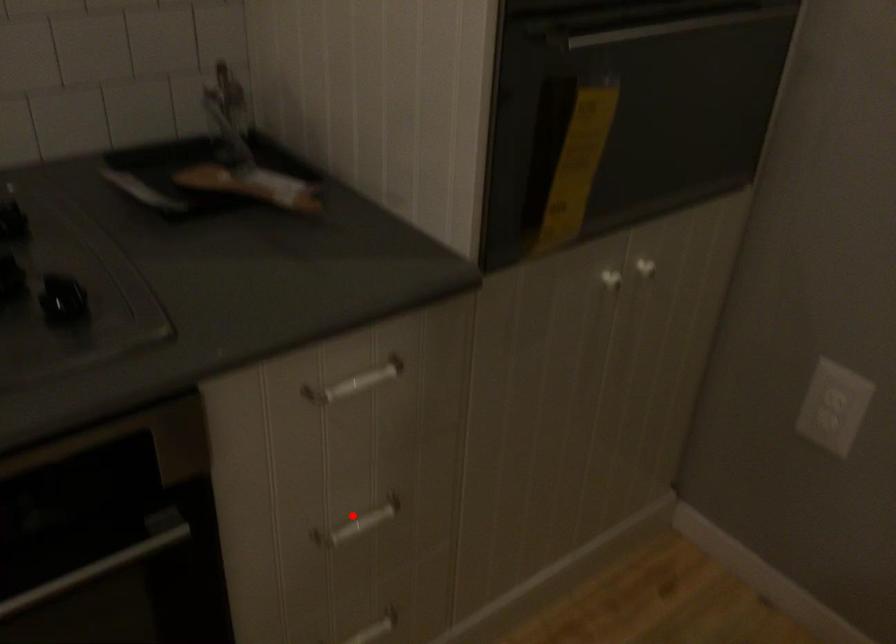
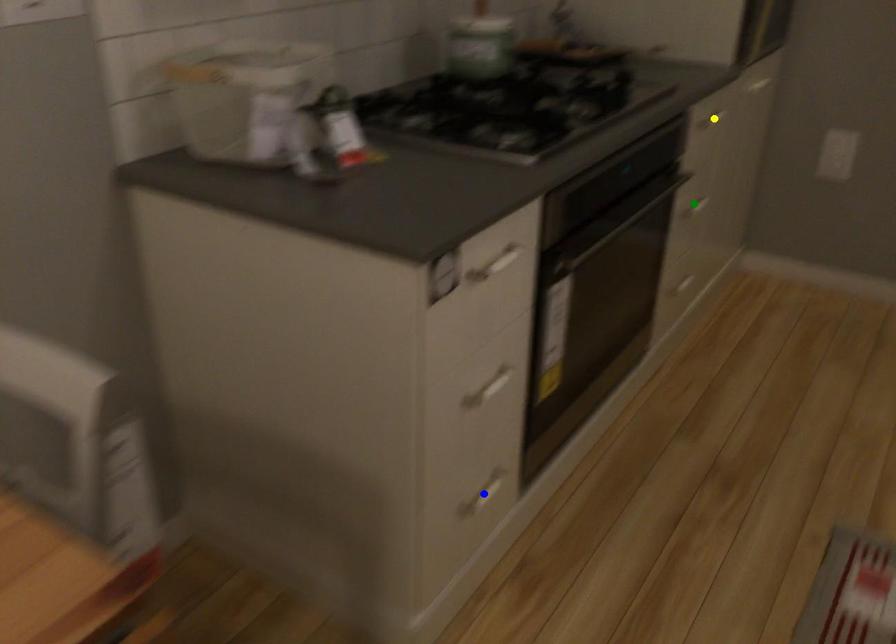
Question: I am providing you with two images of the same scene from different viewpoints. A red point is marked on the first image. You are given multiple points on the second image. Which spot in image 2 lines up with the point in image 1?

Choices:
 (A) green point
 (B) blue point
 (C) yellow point

Answer: (A)